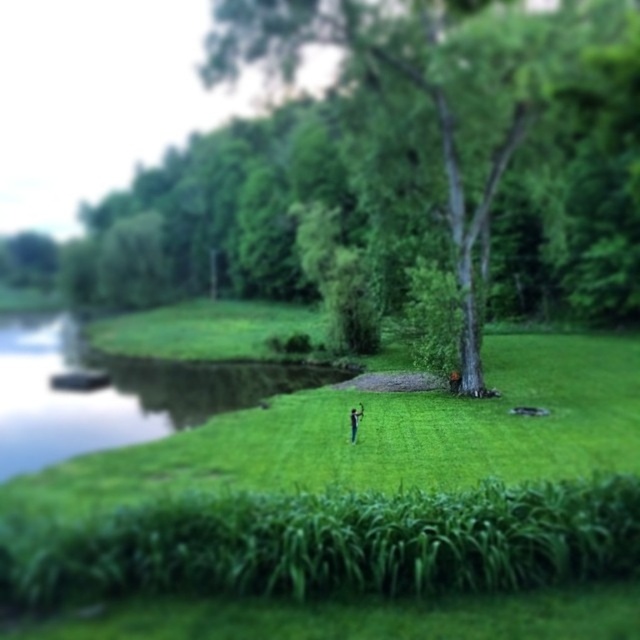
Is green leafy tree at center thinner than green grassy river at left?

Correct, green leafy tree at center's width is less than green grassy river at left's.

Who is more forward, (600, 116) or (4, 456)?

Point (4, 456) is more forward.

Who is more forward, (612,164) or (17,333)?

Positioned in front is point (612,164).

In order to click on green leafy tree at center in this screenshot , I will do `click(474, 116)`.

Does green grassy river at left appear on the left side of blue fabric person at center?

Indeed, green grassy river at left is positioned on the left side of blue fabric person at center.

I want to click on green grassy river at left, so click(113, 392).

You are a GUI agent. You are given a task and a screenshot of the screen. Output one action in this format:
    pyautogui.click(x=<x>, y=<y>)
    Task: Click on the green grassy river at left
    The height and width of the screenshot is (640, 640).
    Given the screenshot: What is the action you would take?
    pyautogui.click(x=113, y=392)

Who is positioned more to the left, green leafy tree at center or blue fabric person at center?

From the viewer's perspective, green leafy tree at center appears more on the left side.

Can you confirm if green leafy tree at center is shorter than blue fabric person at center?

No.

The height and width of the screenshot is (640, 640). What are the coordinates of `green leafy tree at center` in the screenshot? It's located at tap(474, 116).

Locate an element on the screen. Image resolution: width=640 pixels, height=640 pixels. green leafy tree at center is located at coordinates click(x=474, y=116).